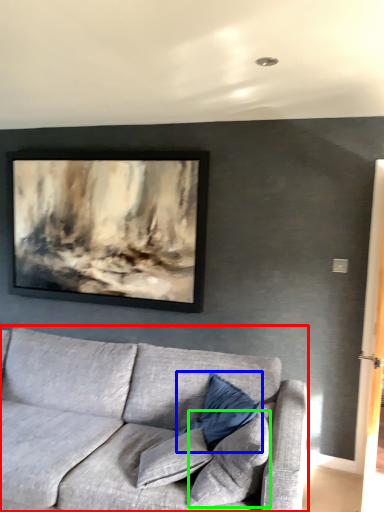
Question: Which is farther away from studio couch (highlighted by a red box)? pillow (highlighted by a blue box) or pillow (highlighted by a green box)?

Choices:
 (A) pillow
 (B) pillow

Answer: (B)